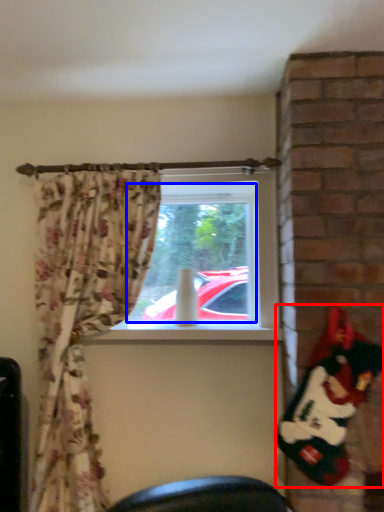
Question: Among these objects, which one is farthest to the camera, santa claus (highlighted by a red box) or window screen (highlighted by a blue box)?

Choices:
 (A) santa claus
 (B) window screen

Answer: (B)